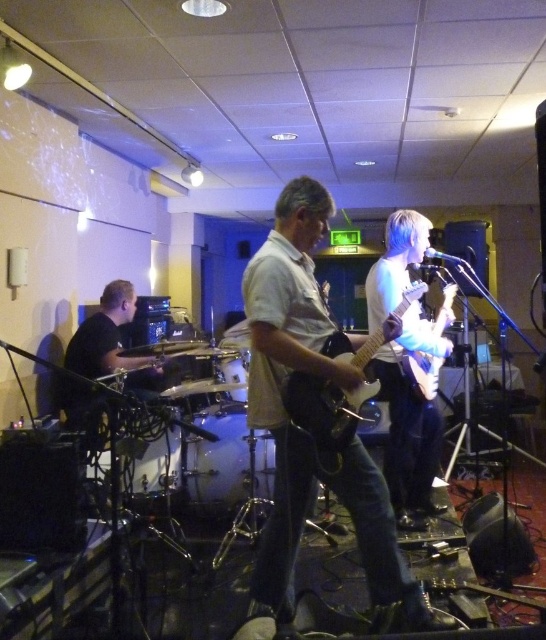
Question: Among these objects, which one is nearest to the camera?

Choices:
 (A) white glossy electric guitar at center
 (B) clear glass drum at center
 (C) white drum at center

Answer: (A)

Question: Can you confirm if light brown leather guitar at center is smaller than white glossy electric guitar at center?

Choices:
 (A) no
 (B) yes

Answer: (B)

Question: Can you confirm if white glossy electric guitar at center is bigger than glossy white guitar at center?

Choices:
 (A) yes
 (B) no

Answer: (A)

Question: Does clear glass drum at center appear on the left side of smooth black drum at center?

Choices:
 (A) yes
 (B) no

Answer: (B)

Question: Which point is farther to the camera?

Choices:
 (A) clear glass drum at center
 (B) light brown leather guitar at center

Answer: (A)

Question: Which point is closer to the camera?

Choices:
 (A) (367, 324)
 (B) (150, 456)
 (C) (206, 417)
 (D) (410, 349)

Answer: (D)